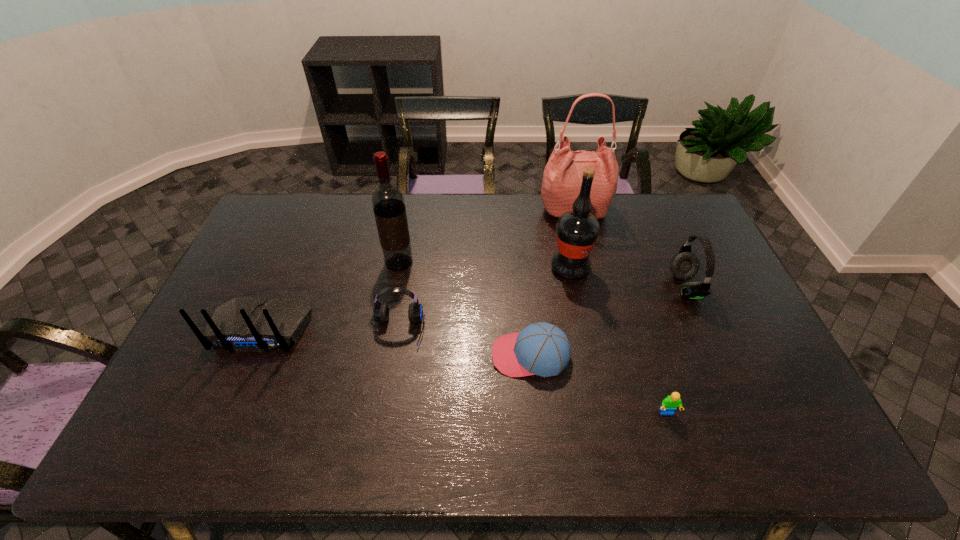
Where is `free space located on the front-facing side of the baseball cap`? This screenshot has height=540, width=960. free space located on the front-facing side of the baseball cap is located at coordinates (394, 355).

Identify the location of vacant region located on the front-facing side of the baseball cap. (437, 355).

The height and width of the screenshot is (540, 960). Identify the location of vacant area situated on the face of the nearest object. (677, 446).

At what (x,y) coordinates should I click in order to perform the action: click on object positioned at the far edge. Please return your answer as a coordinate pair (x, y). This screenshot has height=540, width=960. Looking at the image, I should click on (562, 178).

I want to click on object that is at the left edge, so click(244, 323).

Identify the location of object present at the right edge. The height and width of the screenshot is (540, 960). (684, 265).

I want to click on vacant space at the far edge of the desktop, so click(633, 232).

The height and width of the screenshot is (540, 960). I want to click on vacant point at the near edge, so click(521, 436).

Find the location of `free space at the right edge of the desktop`. free space at the right edge of the desktop is located at coordinates (717, 261).

The width and height of the screenshot is (960, 540). Identify the location of blank space at the far right corner. (663, 203).